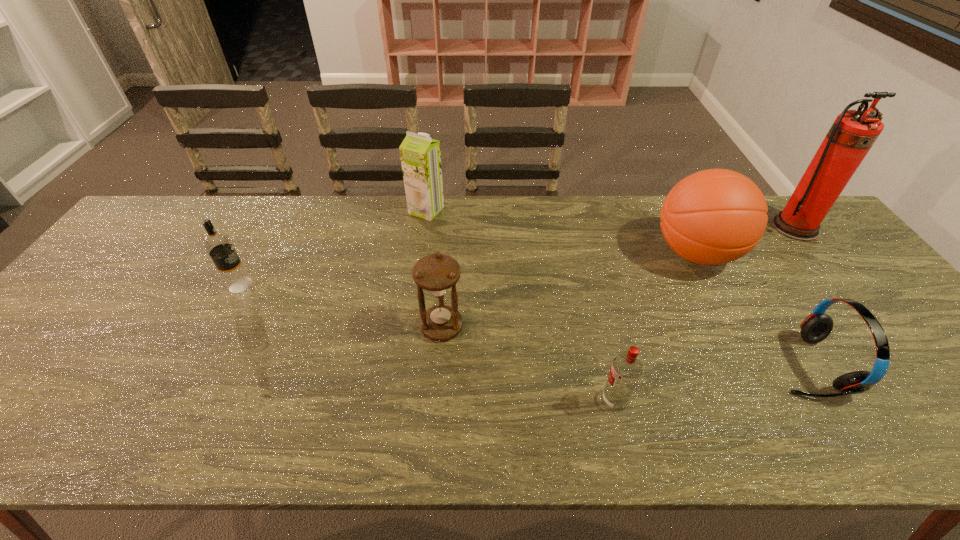
Image resolution: width=960 pixels, height=540 pixels. In order to click on free location located 0.160m at the discharge end of the fire extinguisher in this screenshot , I will do `click(836, 279)`.

At what (x,y) coordinates should I click in order to perform the action: click on free space located on the right of the soya milk. Please return your answer as a coordinate pair (x, y). Image resolution: width=960 pixels, height=540 pixels. Looking at the image, I should click on (459, 210).

Image resolution: width=960 pixels, height=540 pixels. Find the location of `free spot located on the front of the basketball`. free spot located on the front of the basketball is located at coordinates (732, 322).

Locate an element on the screen. This screenshot has height=540, width=960. vacant region located on the label of the taller vodka is located at coordinates (311, 285).

The width and height of the screenshot is (960, 540). Identify the location of blank space located on the back of the hourglass. (448, 238).

What are the coordinates of `vacant space located on the front label of the fourth object from left to right` in the screenshot? It's located at (540, 401).

In order to click on free space located on the front label of the fourth object from left to right in this screenshot , I will do `click(532, 401)`.

This screenshot has width=960, height=540. I want to click on vacant space located on the front label of the fourth object from left to right, so click(463, 401).

Identify the location of free region located with the microphone attached to the side of the headset. The width and height of the screenshot is (960, 540). [x=735, y=365].

Identify the location of vacant space located 0.210m with the microphone attached to the side of the headset. The image size is (960, 540). pos(684,365).